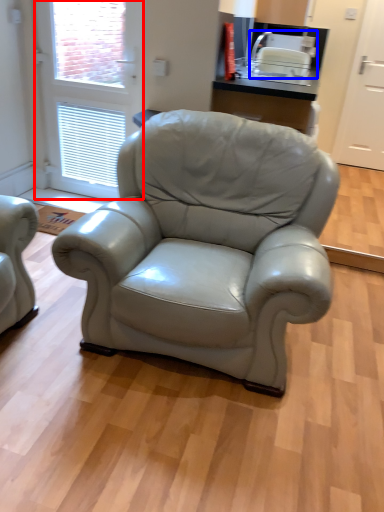
Question: Which point is further to the camera, screen door (highlighted by a red box) or appliance (highlighted by a blue box)?

Choices:
 (A) screen door
 (B) appliance

Answer: (B)